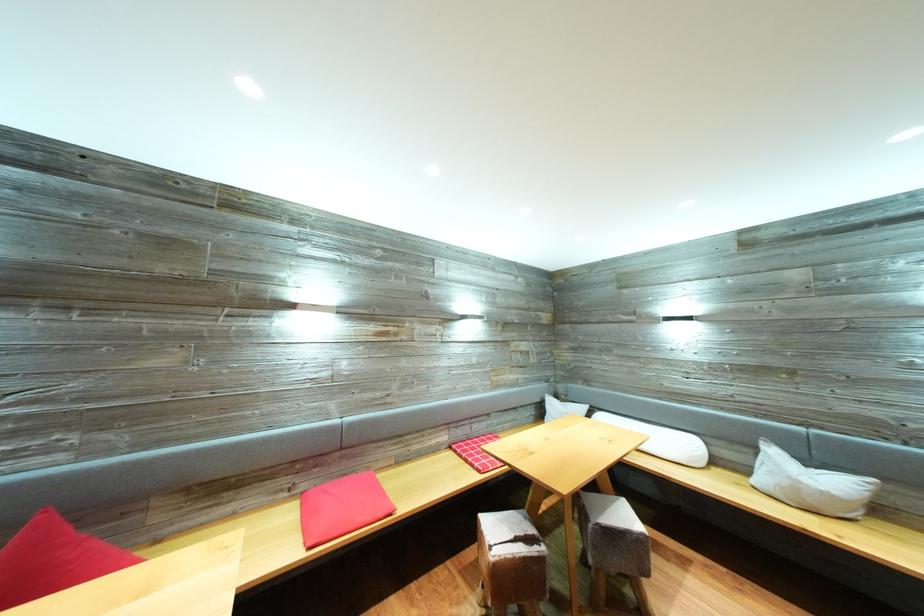
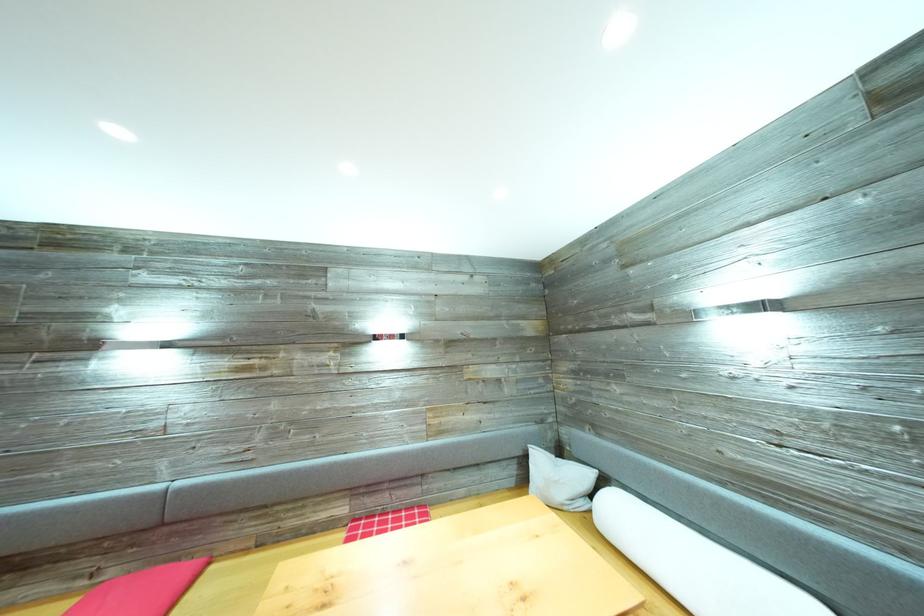
What movement of the cameraman would produce the second image?

The cameraman walked toward right, forward.